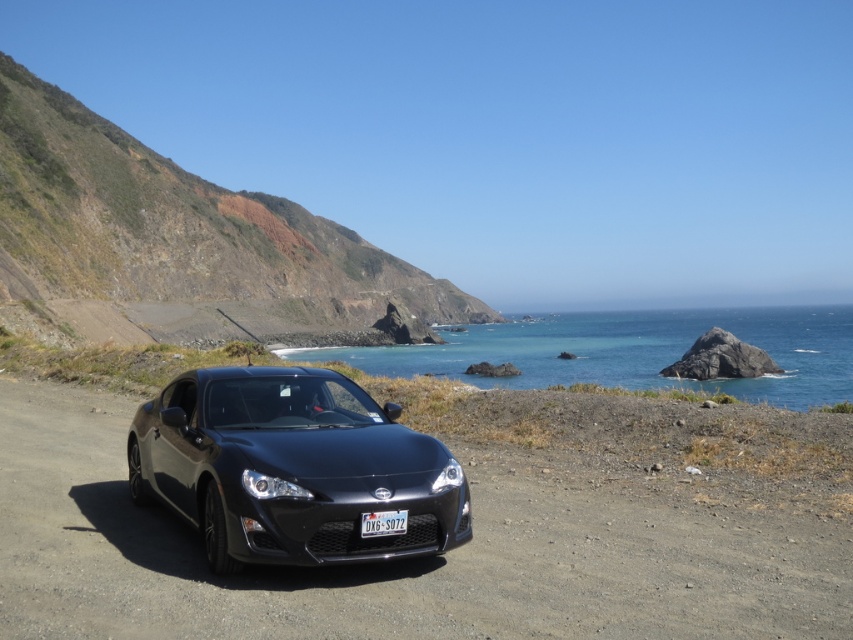
Question: Which point appears closest to the camera in this image?

Choices:
 (A) (361, 531)
 (B) (195, 209)

Answer: (A)

Question: Is matte black car at center to the right of black plastic license plate at center from the viewer's perspective?

Choices:
 (A) no
 (B) yes

Answer: (A)

Question: Does glossy black car at center have a smaller size compared to matte black car at center?

Choices:
 (A) no
 (B) yes

Answer: (A)

Question: Is glossy black car at center positioned behind rustic stone cliff at upper left?

Choices:
 (A) no
 (B) yes

Answer: (A)

Question: Which of the following is the farthest from the observer?

Choices:
 (A) (369, 516)
 (B) (154, 468)
 (C) (143, 230)

Answer: (C)

Question: Which object is farther from the camera taking this photo?

Choices:
 (A) glossy black car at center
 (B) matte black car at center
 (C) black plastic license plate at center
 (D) rustic stone cliff at upper left

Answer: (D)